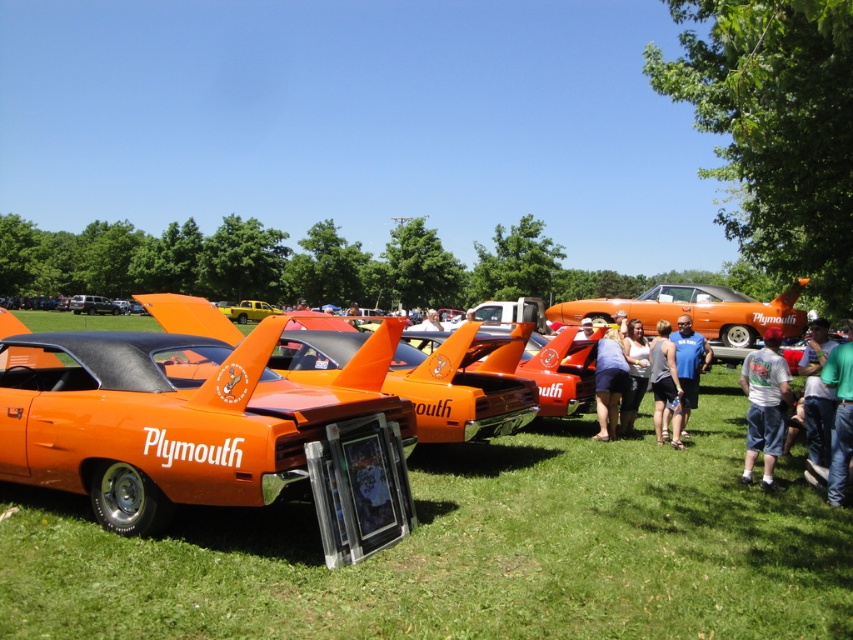
Question: Does shiny orange plymouth car at center have a greater width compared to blue fabric shirt at center?

Choices:
 (A) no
 (B) yes

Answer: (B)

Question: Which object is farther from the camera taking this photo?

Choices:
 (A) denim shorts at center
 (B) shiny orange plymouth car at center
 (C) green denim jeans at lower right

Answer: (A)

Question: Which object is farther from the camera taking this photo?

Choices:
 (A) gray fabric shorts at lower right
 (B) green denim jeans at lower right
 (C) shiny orange plymouth car at center

Answer: (A)

Question: Can you confirm if gray fabric shorts at lower right is smaller than blue fabric shirt at center?

Choices:
 (A) yes
 (B) no

Answer: (A)

Question: Can you confirm if green denim jeans at lower right is wider than matte orange plymouth car at center?

Choices:
 (A) yes
 (B) no

Answer: (B)

Question: Which point appears farthest from the camera in this image?

Choices:
 (A) (135, 371)
 (B) (683, 413)

Answer: (B)